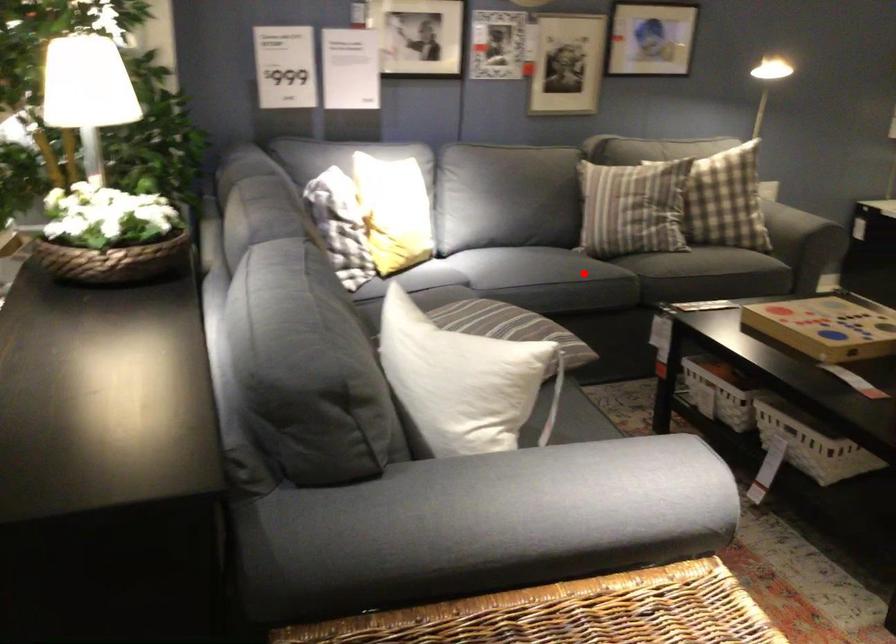
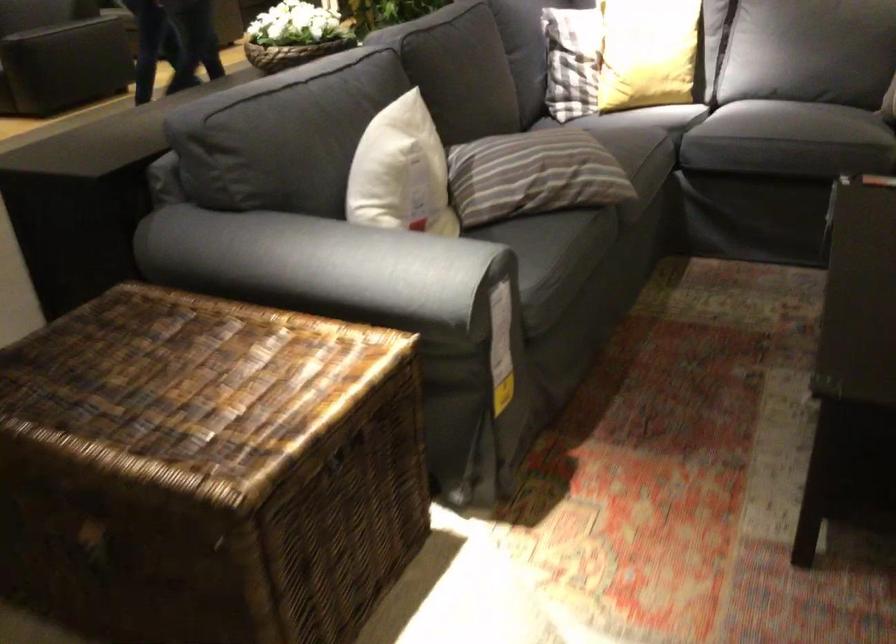
Question: I am providing you with two images of the same scene from different viewpoints. In image1, a red point is highlighted. Considering the same 3D point in image2, which of the following is correct?

Choices:
 (A) It is closer
 (B) It is farther

Answer: (A)